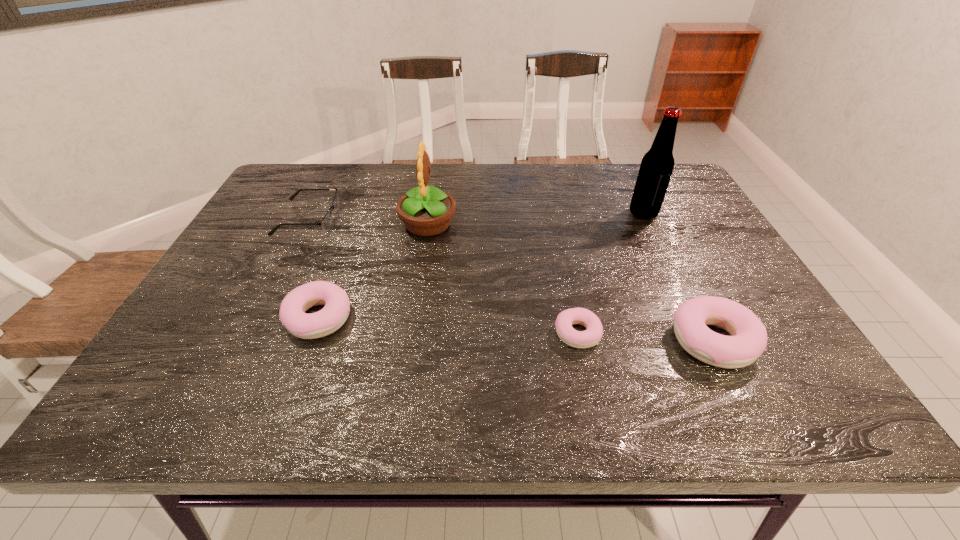
Locate an element on the screen. Image resolution: width=960 pixels, height=540 pixels. pastry that stands as the closest to the rightmost pastry is located at coordinates (579, 339).

Image resolution: width=960 pixels, height=540 pixels. Identify the location of vacant space that satisfies the following two spatial constraints: 1. on the front-facing side of the spectacles; 2. on the left side of the second tallest pastry. (257, 318).

Where is `free space in the image that satisfies the following two spatial constraints: 1. on the front side of the leftmost pastry; 2. on the left side of the rightmost pastry`? This screenshot has height=540, width=960. free space in the image that satisfies the following two spatial constraints: 1. on the front side of the leftmost pastry; 2. on the left side of the rightmost pastry is located at coordinates (311, 341).

Where is `blank area in the image that satisfies the following two spatial constraints: 1. on the front-facing side of the second tallest pastry; 2. on the left side of the spectacles`? blank area in the image that satisfies the following two spatial constraints: 1. on the front-facing side of the second tallest pastry; 2. on the left side of the spectacles is located at coordinates (257, 318).

Image resolution: width=960 pixels, height=540 pixels. In order to click on free spot that satisfies the following two spatial constraints: 1. on the front-facing side of the second shortest object; 2. on the back side of the second tallest pastry in this screenshot , I will do `click(257, 318)`.

This screenshot has height=540, width=960. Find the location of `free location that satisfies the following two spatial constraints: 1. on the back side of the rightmost pastry; 2. on the face of the third object from left to right`. free location that satisfies the following two spatial constraints: 1. on the back side of the rightmost pastry; 2. on the face of the third object from left to right is located at coordinates (655, 225).

Locate an element on the screen. The image size is (960, 540). vacant space that satisfies the following two spatial constraints: 1. on the back side of the shortest pastry; 2. on the face of the sunflower is located at coordinates (554, 225).

The image size is (960, 540). Find the location of `free space that satisfies the following two spatial constraints: 1. on the front-facing side of the rightmost pastry; 2. on the right side of the spectacles`. free space that satisfies the following two spatial constraints: 1. on the front-facing side of the rightmost pastry; 2. on the right side of the spectacles is located at coordinates (246, 341).

Image resolution: width=960 pixels, height=540 pixels. I want to click on vacant position in the image that satisfies the following two spatial constraints: 1. on the back side of the rightmost pastry; 2. on the front-facing side of the fifth tallest object, so click(651, 218).

Identify the location of vacant space that satisfies the following two spatial constraints: 1. on the front-facing side of the leftmost pastry; 2. on the right side of the fifth tallest object. (257, 318).